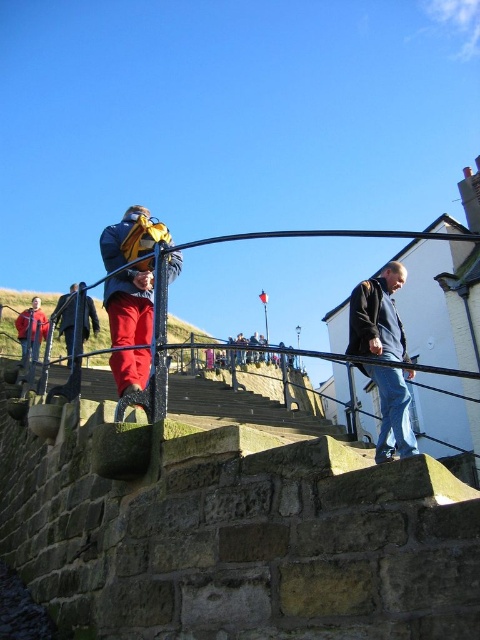
Which is more to the right, red fabric jacket at upper left or matte red jacket at lower left?

matte red jacket at lower left is more to the right.

Does red fabric jacket at upper left have a greater height compared to matte red jacket at lower left?

Indeed, red fabric jacket at upper left has a greater height compared to matte red jacket at lower left.

Find the location of a particular element. Image resolution: width=480 pixels, height=640 pixels. red fabric jacket at upper left is located at coordinates (66, 317).

Identify the location of red fabric jacket at upper left. This screenshot has height=640, width=480. (66, 317).

Who is more distant from viewer, (104, 296) or (82, 333)?

Point (82, 333)

Between matte red jacket at center and red fabric jacket at upper left, which one is positioned higher?

red fabric jacket at upper left is above.

Where is `matte red jacket at center`? matte red jacket at center is located at coordinates (130, 307).

Between point (367, 298) and point (132, 336), which one is positioned in front?

Point (132, 336)

Between dark blue jacket at upper right and matte red jacket at center, which one has less height?

dark blue jacket at upper right

Does point (358, 298) come closer to viewer compared to point (107, 259)?

No, it is not.

In order to click on dark blue jacket at upper right in this screenshot , I will do `click(377, 316)`.